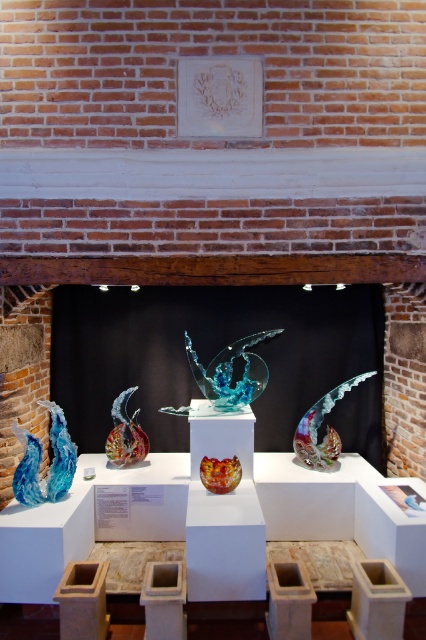
You are an art curator arranging a new exhibit. You want to place a large sculpture in front of the brick wall so that it can be seen clearly. Which object should you place in front, the translucent glass wave at center or the translucent amber glass bowl at center?

The translucent amber glass bowl at center is behind the translucent glass wave at center, so to ensure visibility, you should place the translucent glass wave at center in front.

You are an art installer who needs to ensure the spacing between the translucent glass wave at center and the multicolored glass sculpture at center meets the safety requirement of at least 20 inches. Based on the scene, does the current spacing between them satisfy the requirement?

The translucent glass wave at center is 22.04 inches from the multicolored glass sculpture at center, which exceeds the 20 inches safety requirement. Therefore, the current spacing between them satisfies the requirement.